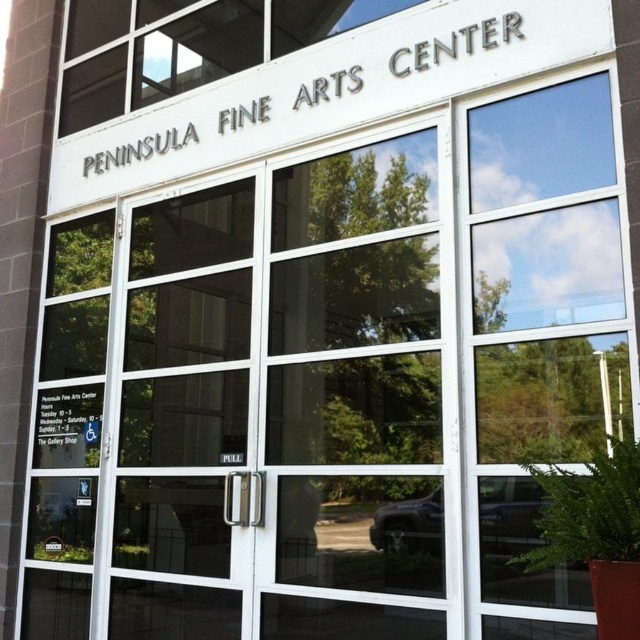
Question: Among these points, which one is farthest from the camera?

Choices:
 (A) (540, 560)
 (B) (70, 547)

Answer: (B)

Question: Does green leafy plant at lower right appear over green leafy plant at lower left?

Choices:
 (A) yes
 (B) no

Answer: (A)

Question: Which of the following is the farthest from the observer?

Choices:
 (A) green leafy plant at lower right
 (B) green leafy plant at lower left

Answer: (B)

Question: Can you confirm if green leafy plant at lower right is positioned to the left of green leafy plant at lower left?

Choices:
 (A) yes
 (B) no

Answer: (B)

Question: Among these points, which one is farthest from the camera?

Choices:
 (A) (634, 531)
 (B) (54, 547)

Answer: (B)

Question: Can you confirm if green leafy plant at lower right is bigger than green leafy plant at lower left?

Choices:
 (A) no
 (B) yes

Answer: (B)